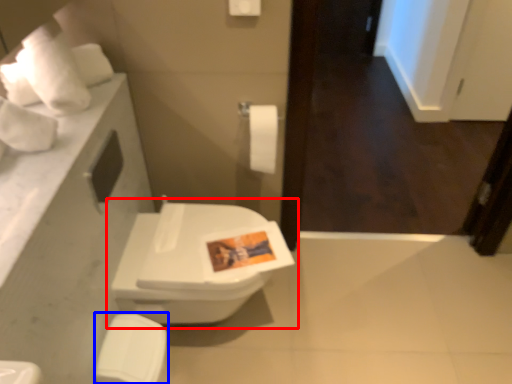
Question: Among these objects, which one is nearest to the camera, toilet (highlighted by a red box) or porcelain (highlighted by a blue box)?

Choices:
 (A) toilet
 (B) porcelain

Answer: (B)